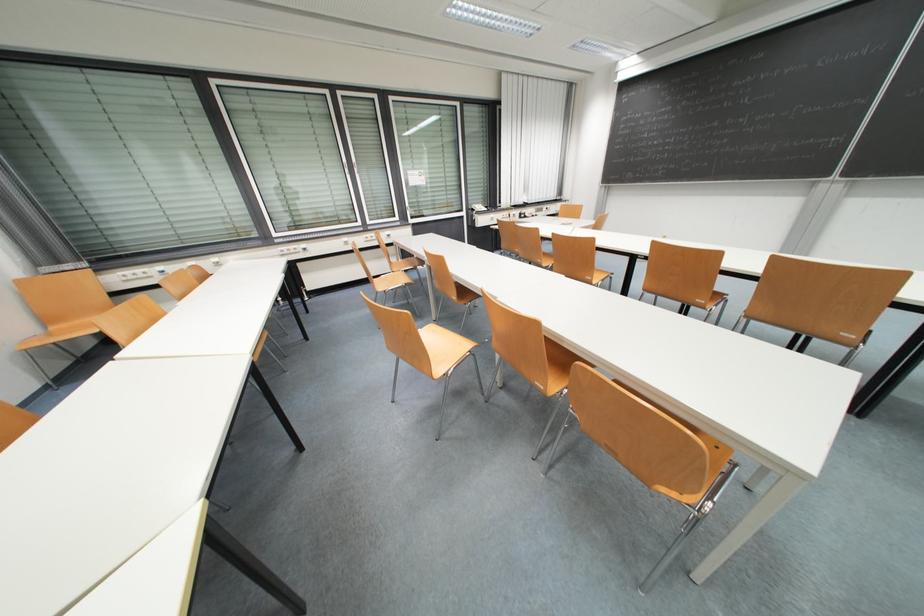
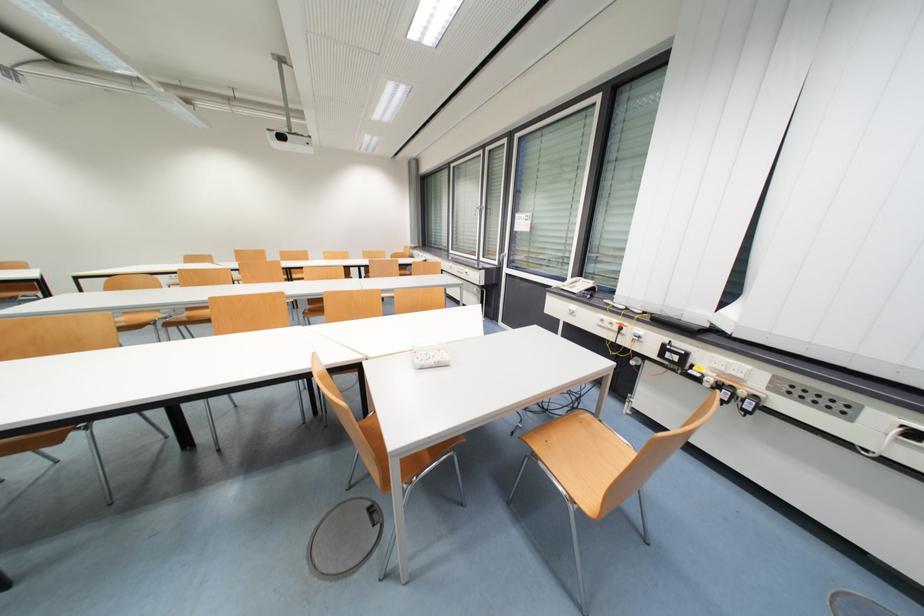
Find the pixel in the second image that matches point 526,216 in the first image.

(671, 350)